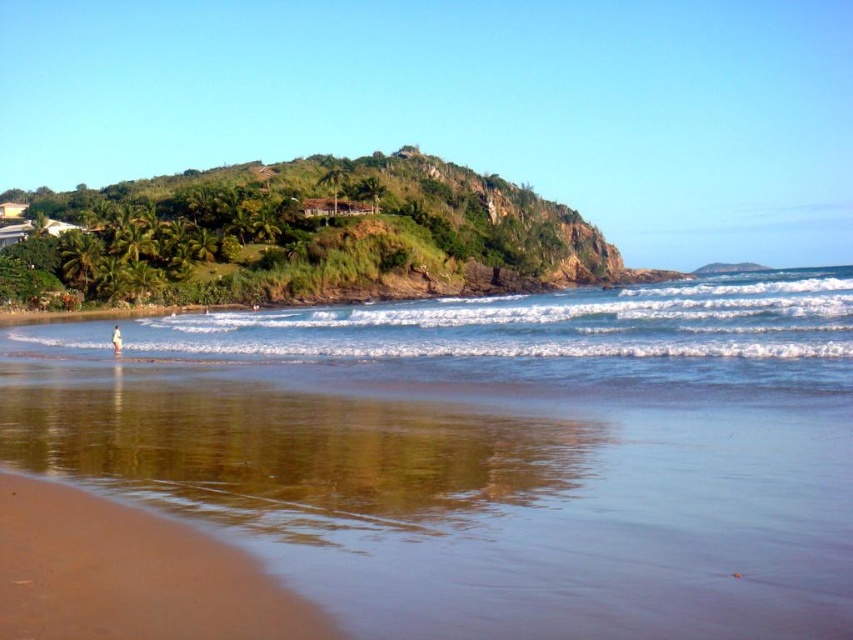
You are standing on the beach and want to take a photo of both the clear blue water at center and the green grassy hill at upper center. Which object should you point your camera towards first to capture both in the frame?

You should point your camera towards the green grassy hill at upper center first since it is above the clear blue water at center, allowing both to be captured in the frame.